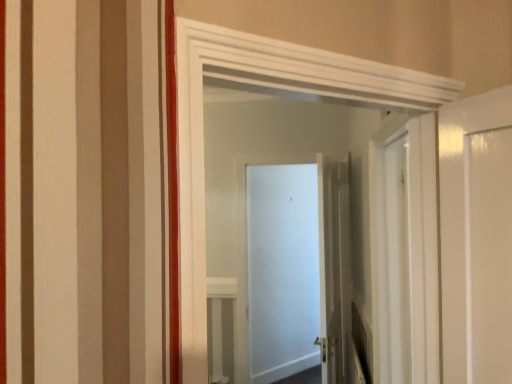
Question: Is white glossy door at center, the 2th door from the back, inside the boundaries of white matte door at center, the 1th door from the back, or outside?

Choices:
 (A) outside
 (B) inside

Answer: (A)

Question: Considering their positions, is white glossy door at center, the 2th door from the back, located in front of or behind white matte door at center, arranged as the third door when viewed from the front?

Choices:
 (A) behind
 (B) front

Answer: (B)

Question: Estimate the real-world distances between objects in this image. Which object is farther from the white glossy door at center, the first door positioned from the front?

Choices:
 (A) white glossy door at center, which ranks as the second door in front-to-back order
 (B) white matte door at center, arranged as the third door when viewed from the front

Answer: (B)

Question: Considering the real-world distances, which object is closest to the white glossy door at center, which ranks as the second door in front-to-back order?

Choices:
 (A) white glossy door at center, which appears as the 3th door when viewed from the back
 (B) white matte door at center, the 1th door from the back

Answer: (B)